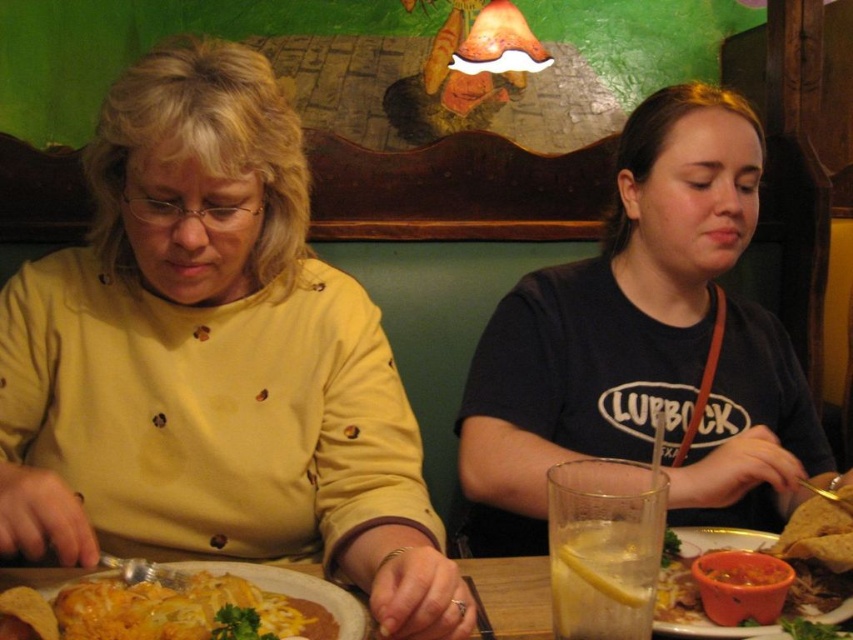
Question: Is black cotton shirt at center closer to camera compared to cheesy tortilla at lower left?

Choices:
 (A) no
 (B) yes

Answer: (A)

Question: Does black cotton shirt at center appear on the right side of cheesy tortilla at lower left?

Choices:
 (A) yes
 (B) no

Answer: (A)

Question: Which of the following is the closest to the observer?

Choices:
 (A) (144, 102)
 (B) (550, 305)
 (C) (238, 564)

Answer: (A)

Question: Does yellow matte shirt at center lie in front of black cotton shirt at center?

Choices:
 (A) no
 (B) yes

Answer: (B)

Question: Which point is closer to the camera taking this photo?

Choices:
 (A) (294, 627)
 (B) (212, 570)

Answer: (A)

Question: Which point is farther to the camera?

Choices:
 (A) yellow matte shirt at center
 (B) wooden table at center
 (C) black cotton shirt at center

Answer: (C)